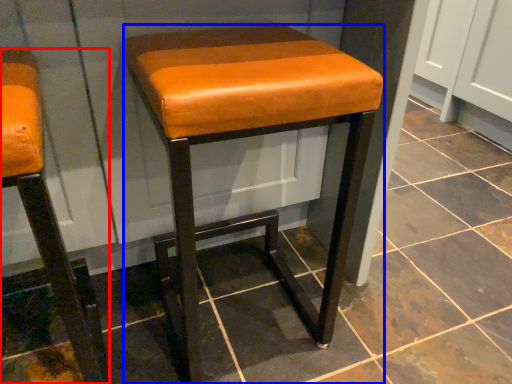
Question: Which of the following is the farthest to the observer, stool (highlighted by a red box) or stool (highlighted by a blue box)?

Choices:
 (A) stool
 (B) stool

Answer: (B)